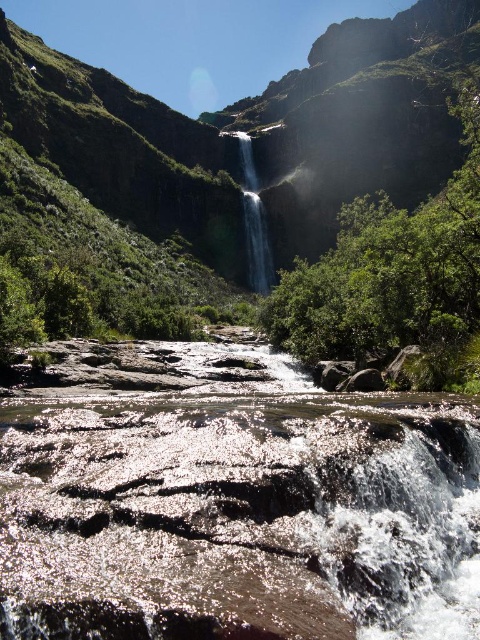
You are standing at the edge of the cliff overlooking the waterfall. You see the green mossy rock at center and the clear glass waterfall at upper center. Which object is closer to you?

The green mossy rock at center is closer to the viewer than the clear glass waterfall at upper center.

You are standing at the base of the waterfall and want to place a small statue on the green mossy rock at center. Can you see the statue from the clear glass waterfall at upper center?

The green mossy rock at center is located above the clear glass waterfall at upper center, so if you place the statue on the green mossy rock at center, it would be visible from the clear glass waterfall at upper center as it is positioned below.

You are standing at the point labeled as point (236, 506) in the image of the waterfall scene. What is the material of the surface you are currently standing on?

The point (236, 506) is on a shiny brown rock at center, so the surface you are standing on is shiny brown rock.